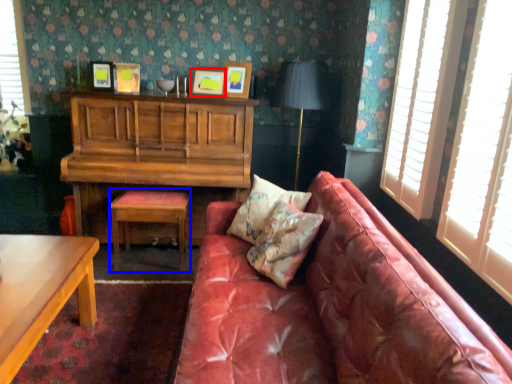
Question: Which object appears closest to the camera in this image, picture frame (highlighted by a red box) or stool (highlighted by a blue box)?

Choices:
 (A) picture frame
 (B) stool

Answer: (B)